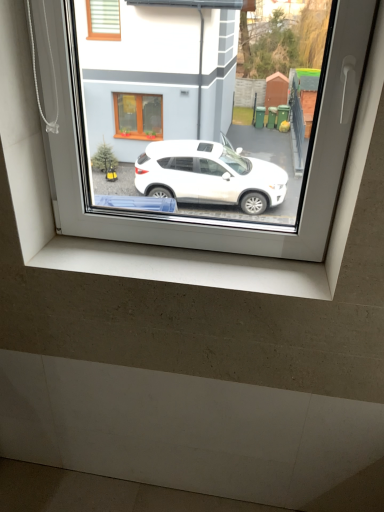
Find the location of a particular element. white concrete window sill at lower center is located at coordinates (180, 266).

What do you see at coordinates (180, 266) in the screenshot? I see `white concrete window sill at lower center` at bounding box center [180, 266].

The width and height of the screenshot is (384, 512). In order to click on transparent glass window at center in this screenshot , I will do `click(195, 223)`.

This screenshot has height=512, width=384. What do you see at coordinates (195, 223) in the screenshot? I see `transparent glass window at center` at bounding box center [195, 223].

Find the location of `white concrete window sill at lower center`. white concrete window sill at lower center is located at coordinates (180, 266).

Based on the photo, is transparent glass window at center at the left side of white concrete window sill at lower center?

Incorrect, transparent glass window at center is not on the left side of white concrete window sill at lower center.

Which object is further away from the camera taking this photo, transparent glass window at center or white concrete window sill at lower center?

white concrete window sill at lower center is behind.

Does point (188, 223) appear closer or farther from the camera than point (70, 237)?

Point (188, 223).

In the scene shown: From the image's perspective, is transparent glass window at center above or below white concrete window sill at lower center?

From the image's perspective, transparent glass window at center appears above white concrete window sill at lower center.

From a real-world perspective, which is physically above, transparent glass window at center or white concrete window sill at lower center?

From a 3D spatial view, transparent glass window at center is above.

Which of these two, transparent glass window at center or white concrete window sill at lower center, is wider?

Wider between the two is white concrete window sill at lower center.

From their relative heights in the image, would you say transparent glass window at center is taller or shorter than white concrete window sill at lower center?

In the image, transparent glass window at center appears to be taller than white concrete window sill at lower center.

In terms of size, does transparent glass window at center appear bigger or smaller than white concrete window sill at lower center?

Considering their sizes, transparent glass window at center takes up more space than white concrete window sill at lower center.

Is transparent glass window at center located outside white concrete window sill at lower center?

Yes, transparent glass window at center is not within white concrete window sill at lower center.

Is transparent glass window at center not close to white concrete window sill at lower center?

No, transparent glass window at center is not far from white concrete window sill at lower center.

Is transparent glass window at center positioned with its back to white concrete window sill at lower center?

No, transparent glass window at center is not facing away from white concrete window sill at lower center.

How different are the orientations of transparent glass window at center and white concrete window sill at lower center in degrees?

6.27e-05 degrees.

Find the location of a particular element. The image size is (384, 512). window above the white concrete window sill at lower center (from the image's perspective) is located at coordinates (195, 223).

Between white concrete window sill at lower center and transparent glass window at center, which one appears on the left side from the viewer's perspective?

white concrete window sill at lower center is more to the left.

Considering the relative positions of white concrete window sill at lower center and transparent glass window at center in the image provided, is white concrete window sill at lower center behind transparent glass window at center?

Yes, white concrete window sill at lower center is behind transparent glass window at center.

Which is farther, (270,290) or (68,214)?

The point (68,214) is farther from the camera.

From the image's perspective, between white concrete window sill at lower center and transparent glass window at center, who is located below?

white concrete window sill at lower center, from the image's perspective.

From a real-world perspective, is white concrete window sill at lower center over transparent glass window at center?

Incorrect, from a real-world perspective, white concrete window sill at lower center is lower than transparent glass window at center.

Does white concrete window sill at lower center have a greater width compared to transparent glass window at center?

Correct, the width of white concrete window sill at lower center exceeds that of transparent glass window at center.

Who is taller, white concrete window sill at lower center or transparent glass window at center?

With more height is transparent glass window at center.

Which of these two, white concrete window sill at lower center or transparent glass window at center, is bigger?

transparent glass window at center is bigger.

Would you say white concrete window sill at lower center is outside transparent glass window at center?

Yes, white concrete window sill at lower center is outside of transparent glass window at center.

Is white concrete window sill at lower center placed right next to transparent glass window at center?

No, white concrete window sill at lower center is not making contact with transparent glass window at center.

Is white concrete window sill at lower center aimed at transparent glass window at center?

No, white concrete window sill at lower center is not aimed at transparent glass window at center.

How different are the orientations of white concrete window sill at lower center and transparent glass window at center in degrees?

white concrete window sill at lower center and transparent glass window at center are facing 6.27e-05 degrees away from each other.

Image resolution: width=384 pixels, height=512 pixels. Find the location of `window above the white concrete window sill at lower center (from a real-world perspective)`. window above the white concrete window sill at lower center (from a real-world perspective) is located at coordinates (195, 223).

Locate an element on the screen. window in front of the white concrete window sill at lower center is located at coordinates (195, 223).

Identify the location of window on the right of white concrete window sill at lower center. click(x=195, y=223).